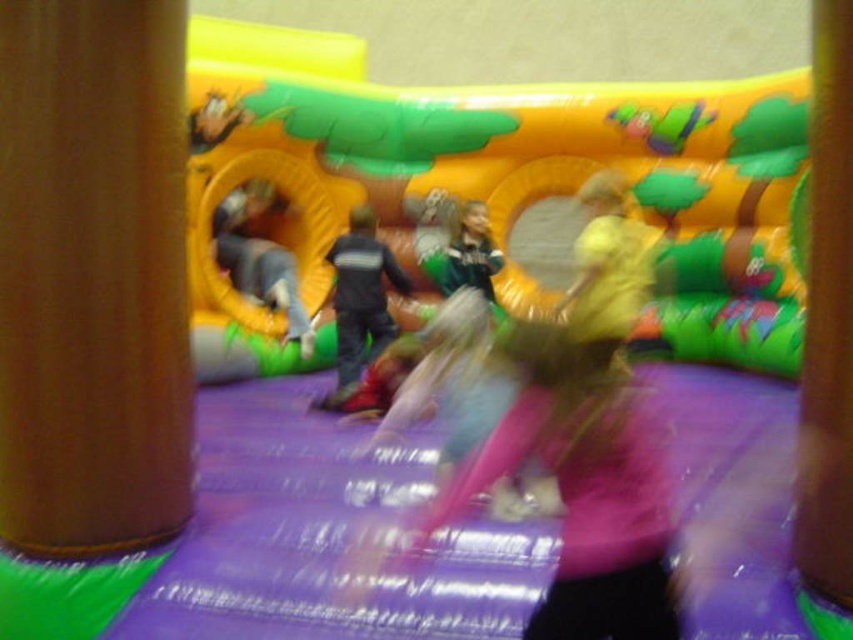
You are a parent supervising children in the bounce house. You notice two pillars inside the bounce house. Which pillar is more to the left side? The brown leather pillar at left or the brown wood pillar at center left?

The brown leather pillar at left is positioned on the left side of brown wood pillar at center left, so the brown leather pillar at left is more to the left side.

You are a parent trying to ensure safety in the bounce house. You need to know if the distance between the purple fabric slide at center and the brown wood pillar at center left is sufficient for a child to move between them without collision. The child requires a minimum of 3 meters of space. Can they safely move between these two points?

The distance between the purple fabric slide at center and the brown wood pillar at center left is 4.72 meters, which exceeds the required 3 meters. Therefore, the child can safely move between them without collision.